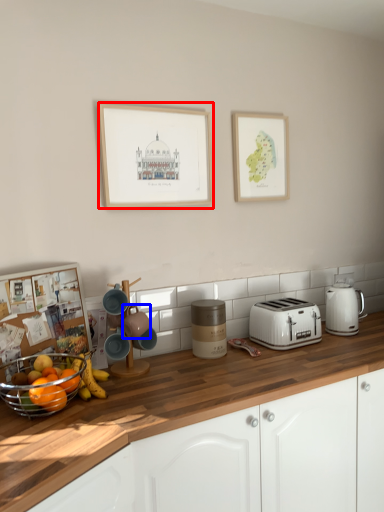
Question: Which object is closer to the camera taking this photo, picture frame (highlighted by a red box) or appliance (highlighted by a blue box)?

Choices:
 (A) picture frame
 (B) appliance

Answer: (B)